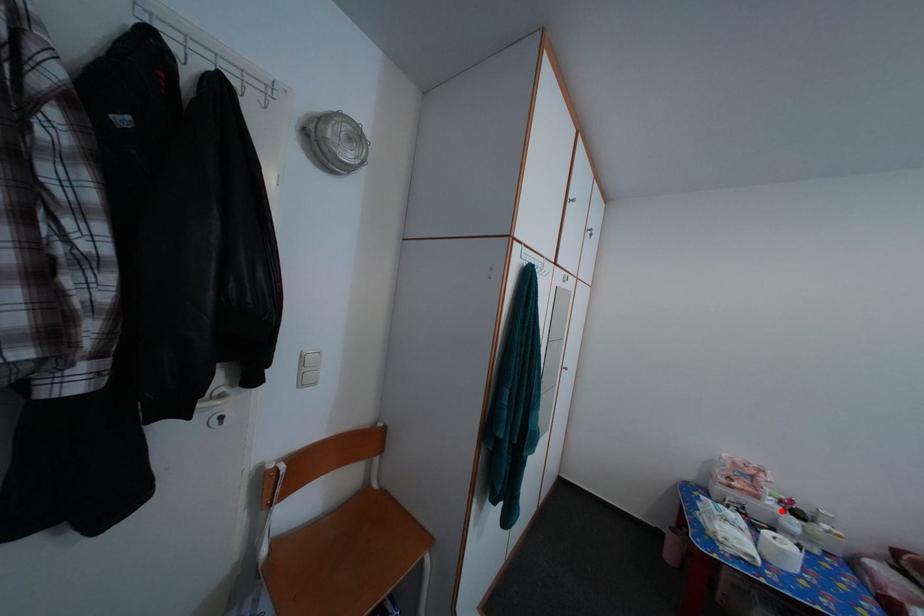
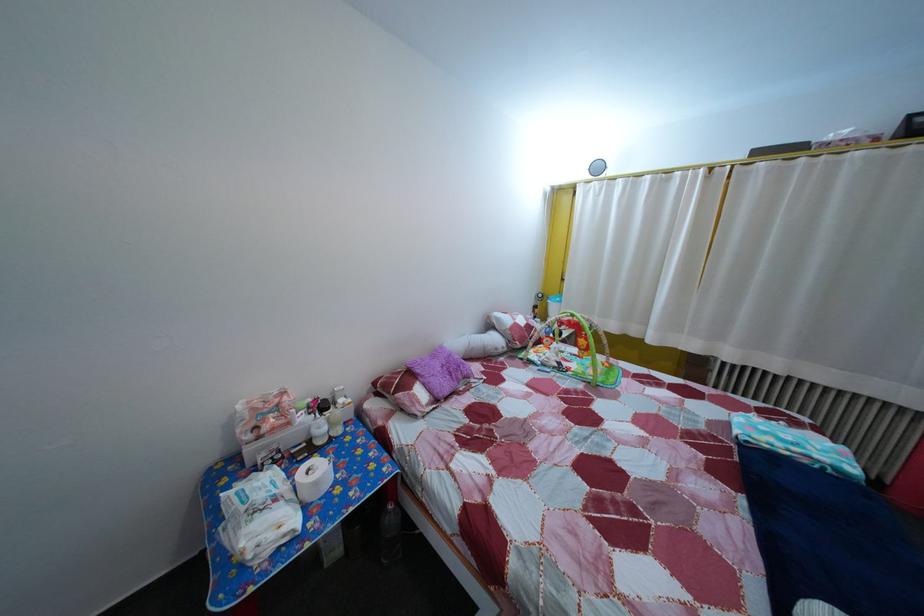
Question: I am providing you with two images of the same scene from different viewpoints. In image1, a red point is highlighted. Considering the same 3D point in image2, which of the following is correct?

Choices:
 (A) It is closer
 (B) It is farther

Answer: (B)